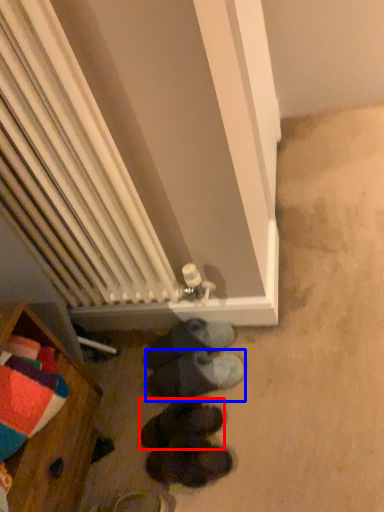
Question: Which object appears farthest to the camera in this image, footwear (highlighted by a red box) or footwear (highlighted by a blue box)?

Choices:
 (A) footwear
 (B) footwear

Answer: (B)